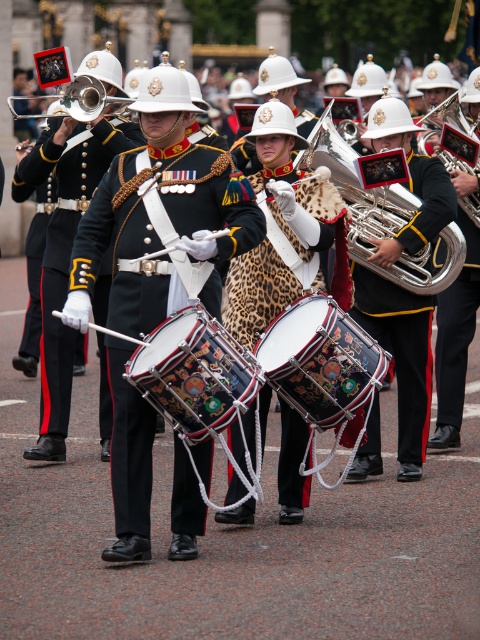
Question: Which of the following is the closest to the observer?

Choices:
 (A) (311, 259)
 (B) (242, 358)
 (C) (131, 529)

Answer: (C)

Question: Which object is farther from the camera taking this photo?

Choices:
 (A) decorative leather drum at center
 (B) shiny silver tuba at center
 (C) shiny metallic drum at center

Answer: (B)

Question: Among these objects, which one is farthest from the camera?

Choices:
 (A) decorative leather drum at center
 (B) shiny silver trumpet at center
 (C) polished silver trumpet at center
 (D) shiny silver tuba at center

Answer: (B)

Question: Considering the relative positions of shiny silver tuba at center and shiny silver trumpet at center in the image provided, where is shiny silver tuba at center located with respect to shiny silver trumpet at center?

Choices:
 (A) above
 (B) below

Answer: (B)

Question: Can you confirm if shiny black drum at center is bigger than decorative leather drum at center?

Choices:
 (A) no
 (B) yes

Answer: (A)

Question: Does decorative leather drum at center have a larger size compared to shiny silver trumpet at center?

Choices:
 (A) yes
 (B) no

Answer: (B)